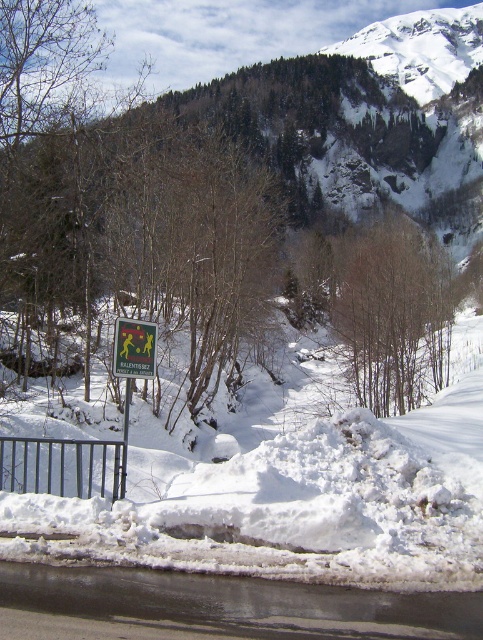
Question: Among these points, which one is farthest from the camera?

Choices:
 (A) (132, 365)
 (B) (270, 484)
 (C) (125, 406)

Answer: (C)

Question: Does white snow ski slope at center lie behind green plastic sign at lower left?

Choices:
 (A) no
 (B) yes

Answer: (A)

Question: Can you confirm if green plastic sign at lower left is bigger than green plastic sign at left?

Choices:
 (A) no
 (B) yes

Answer: (B)

Question: Which point is closer to the camera taking this photo?

Choices:
 (A) (315, 380)
 (B) (144, 374)

Answer: (B)

Question: From the image, what is the correct spatial relationship of white snow ski slope at center in relation to green plastic sign at lower left?

Choices:
 (A) right
 (B) left

Answer: (A)

Question: Which of the following is the closest to the observer?

Choices:
 (A) white snow ski slope at center
 (B) green plastic sign at left
 (C) green plastic sign at lower left

Answer: (A)